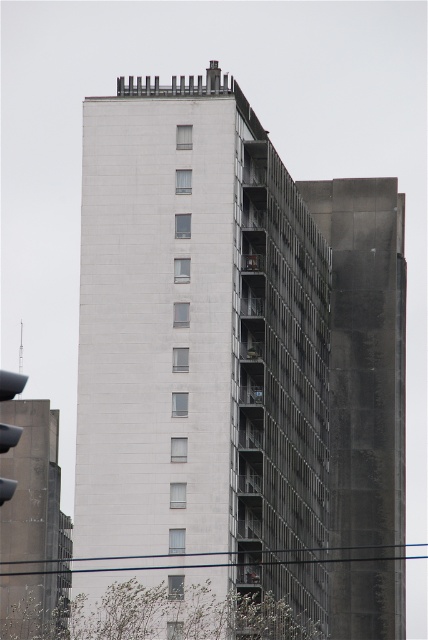
You are standing in front of the residential building and want to take a photo. You notice two points marked on the building. The first point is at coordinate point (318, 403) and the second is at point (12, 490). Which point will appear closer to the center of your camera view?

Point (318, 403) is further to the camera than point (12, 490), so the point (12, 490) will appear closer to the center of your camera view.

You are a city planner analyzing the layout of this area. The white concrete building at center and the matte black traffic light at left are both critical to urban planning. Based on their sizes, which one is more likely to be closer to the observer?

The white concrete building at center has a smaller size compared to matte black traffic light at left, so the matte black traffic light at left is closer to the observer because objects closer in proximity appear larger in size.

You are standing on the sidewalk looking at the white concrete building at center and the matte black traffic light at left. Which object is positioned higher from the ground?

The white concrete building at center is positioned higher from the ground than the matte black traffic light at left because it is above it.